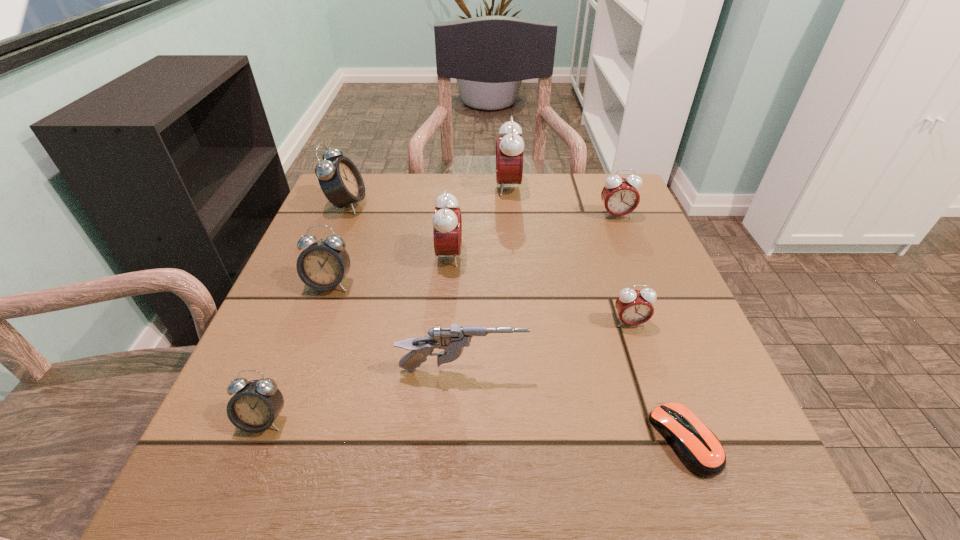
Identify the location of the smallest white alarm clock. (256, 404).

Where is `the nearest white alarm clock`? the nearest white alarm clock is located at coordinates (256, 404).

I want to click on orange computer mouse, so click(x=698, y=448).

In order to click on computer mouse in this screenshot , I will do `click(698, 448)`.

The image size is (960, 540). In order to click on blank space located on the clock face of the fifth alarm clock from left to right in this screenshot , I will do `click(399, 187)`.

Locate an element on the screen. vacant region located 0.100m on the clock face of the fifth alarm clock from left to right is located at coordinates (457, 187).

At what (x,y) coordinates should I click in order to perform the action: click on vacant space located on the clock face of the fifth alarm clock from left to right. Please return your answer as a coordinate pair (x, y). This screenshot has width=960, height=540. Looking at the image, I should click on (361, 187).

This screenshot has height=540, width=960. I want to click on vacant region located on the face of the biggest white alarm clock, so click(x=440, y=204).

At what (x,y) coordinates should I click in order to perform the action: click on vacant space situated 0.250m on the clock face of the second nearest pink alarm clock. Please return your answer as a coordinate pair (x, y). Looking at the image, I should click on (580, 255).

Where is `vacant region located on the clock face of the third nearest pink alarm clock`? vacant region located on the clock face of the third nearest pink alarm clock is located at coordinates (627, 241).